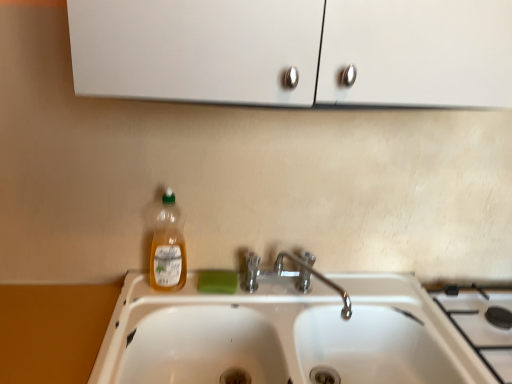
This screenshot has width=512, height=384. I want to click on white ceramic gas stove at lower right, so click(x=481, y=325).

Where is `green matte soap at sink`? The height and width of the screenshot is (384, 512). green matte soap at sink is located at coordinates (217, 282).

The width and height of the screenshot is (512, 384). What do you see at coordinates (285, 334) in the screenshot?
I see `white glossy sink at center` at bounding box center [285, 334].

Measure the distance between white glossy sink at center and camera.

white glossy sink at center and camera are 81.50 centimeters apart.

Find the location of `white ceramic gas stove at lower right`. white ceramic gas stove at lower right is located at coordinates (481, 325).

Can you confirm if translucent plastic bottle at center is taller than green matte soap at sink?

Correct, translucent plastic bottle at center is much taller as green matte soap at sink.

From the image's perspective, between translucent plastic bottle at center and green matte soap at sink, which one is located above?

translucent plastic bottle at center is shown above in the image.

Which of these two, translucent plastic bottle at center or green matte soap at sink, is thinner?

Thinner between the two is green matte soap at sink.

From a real-world perspective, which object stands above the other?

translucent plastic bottle at center, from a real-world perspective.

Is white glossy sink at center thinner than translucent plastic bottle at center?

Incorrect, the width of white glossy sink at center is not less than that of translucent plastic bottle at center.

Is white glossy sink at center not close to translucent plastic bottle at center?

No.

Identify the location of sink lying on the right of translucent plastic bottle at center. Image resolution: width=512 pixels, height=384 pixels. (285, 334).

Between white glossy sink at center and translucent plastic bottle at center, which one has less height?

Standing shorter between the two is white glossy sink at center.

Is white ceramic gas stove at lower right to the right of green matte soap at sink from the viewer's perspective?

Correct, you'll find white ceramic gas stove at lower right to the right of green matte soap at sink.

Can you confirm if white ceramic gas stove at lower right is smaller than green matte soap at sink?

No, white ceramic gas stove at lower right is not smaller than green matte soap at sink.

Is white ceramic gas stove at lower right in front of or behind green matte soap at sink in the image?

In the image, white ceramic gas stove at lower right appears in front of green matte soap at sink.

Based on the photo, is white ceramic gas stove at lower right looking in the opposite direction of translucent plastic bottle at center?

No, white ceramic gas stove at lower right is not facing away from translucent plastic bottle at center.

Is white ceramic gas stove at lower right bigger than translucent plastic bottle at center?

Yes.

From the picture: Can you confirm if white ceramic gas stove at lower right is positioned to the right of translucent plastic bottle at center?

Yes.

From the image's perspective, which one is positioned lower, white ceramic gas stove at lower right or translucent plastic bottle at center?

white ceramic gas stove at lower right.

Is the position of white glossy sink at center less distant than that of chrome metallic faucet at sink center?

That is True.

From a real-world perspective, who is located lower, white glossy sink at center or chrome metallic faucet at sink center?

From a 3D spatial view, white glossy sink at center is below.

Is white glossy sink at center touching chrome metallic faucet at sink center?

There is a gap between white glossy sink at center and chrome metallic faucet at sink center.

Is white glossy sink at center oriented away from chrome metallic faucet at sink center?

No, white glossy sink at center's orientation is not away from chrome metallic faucet at sink center.

From the picture: From a real-world perspective, is green matte soap at sink above or below white glossy sink at center?

green matte soap at sink is above white glossy sink at center.

Is green matte soap at sink not close to white glossy sink at center?

They are positioned close to each other.

Considering the relative sizes of green matte soap at sink and white glossy sink at center in the image provided, is green matte soap at sink smaller than white glossy sink at center?

Yes.

Can you confirm if green matte soap at sink is thinner than white glossy sink at center?

Correct, the width of green matte soap at sink is less than that of white glossy sink at center.

From a real-world perspective, is chrome metallic faucet at sink center positioned above or below translucent plastic bottle at center?

From a real-world perspective, chrome metallic faucet at sink center is physically below translucent plastic bottle at center.

Between chrome metallic faucet at sink center and translucent plastic bottle at center, which one has smaller width?

translucent plastic bottle at center is thinner.

Where is `bottle on the left of chrome metallic faucet at sink center`? This screenshot has width=512, height=384. bottle on the left of chrome metallic faucet at sink center is located at coordinates (168, 248).

Locate an element on the screen. Image resolution: width=512 pixels, height=384 pixels. soap behind the translucent plastic bottle at center is located at coordinates (217, 282).

The image size is (512, 384). Find the location of `bottle located above the white glossy sink at center (from the image's perspective)`. bottle located above the white glossy sink at center (from the image's perspective) is located at coordinates (168, 248).

Looking at this image, estimate the real-world distances between objects in this image. Which object is closer to chrome metallic faucet at sink center, green matte soap at sink or translucent plastic bottle at center?

Based on the image, green matte soap at sink appears to be nearer to chrome metallic faucet at sink center.

Which object lies nearer to the anchor point chrome metallic faucet at sink center, green matte soap at sink or white glossy sink at center?

green matte soap at sink is positioned closer to the anchor chrome metallic faucet at sink center.

Based on the photo, looking at the image, which one is located further to translucent plastic bottle at center, white ceramic gas stove at lower right or white glossy sink at center?

white ceramic gas stove at lower right is further to translucent plastic bottle at center.

Looking at the image, which one is located closer to translucent plastic bottle at center, chrome metallic faucet at sink center or white ceramic gas stove at lower right?

chrome metallic faucet at sink center is closer to translucent plastic bottle at center.

When comparing their distances from green matte soap at sink, does white ceramic gas stove at lower right or translucent plastic bottle at center seem closer?

translucent plastic bottle at center.

When comparing their distances from green matte soap at sink, does chrome metallic faucet at sink center or white glossy sink at center seem further?

white glossy sink at center.

Estimate the real-world distances between objects in this image. Which object is closer to white ceramic gas stove at lower right, chrome metallic faucet at sink center or translucent plastic bottle at center?

chrome metallic faucet at sink center is positioned closer to the anchor white ceramic gas stove at lower right.

Estimate the real-world distances between objects in this image. Which object is further from green matte soap at sink, white glossy sink at center or translucent plastic bottle at center?

The object further to green matte soap at sink is white glossy sink at center.

Where is `tap located between green matte soap at sink and white ceramic gas stove at lower right in the left-right direction`? This screenshot has width=512, height=384. tap located between green matte soap at sink and white ceramic gas stove at lower right in the left-right direction is located at coordinates (309, 278).

This screenshot has height=384, width=512. I want to click on soap situated between translucent plastic bottle at center and chrome metallic faucet at sink center from left to right, so click(217, 282).

Identify the location of sink between translucent plastic bottle at center and white ceramic gas stove at lower right from left to right. (285, 334).

Identify the location of sink located between green matte soap at sink and white ceramic gas stove at lower right in the left-right direction. This screenshot has width=512, height=384. (285, 334).